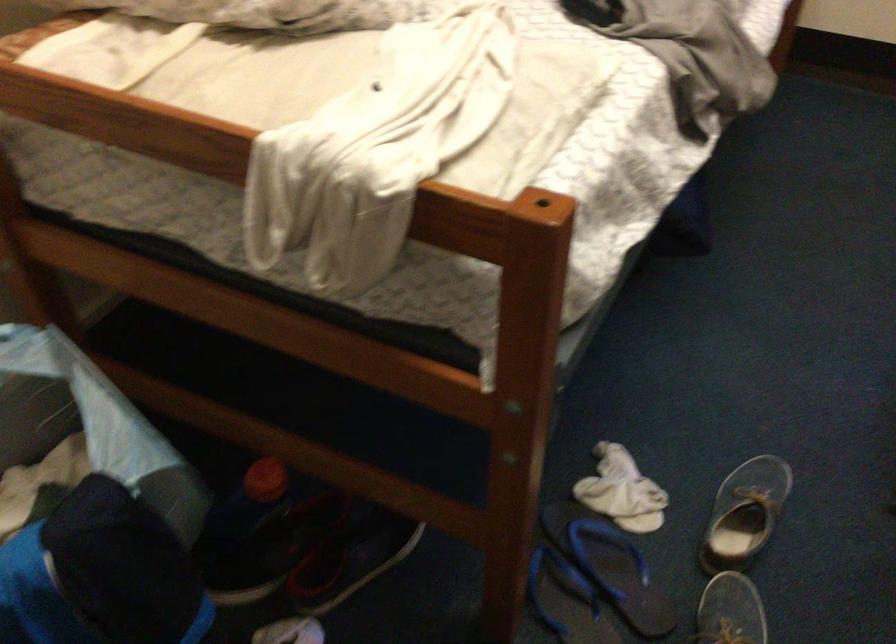
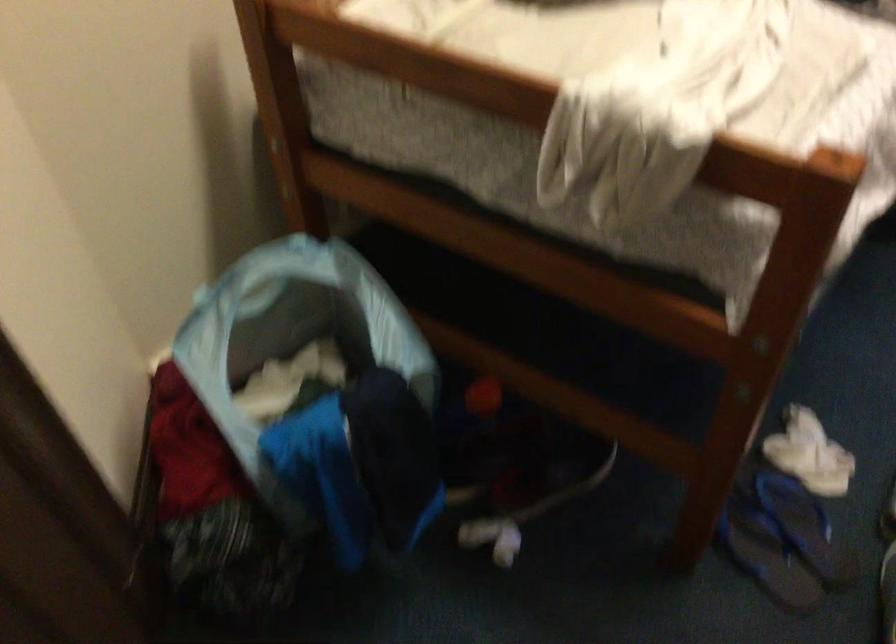
Question: The camera is either moving clockwise (left) or counter-clockwise (right) around the object. The first image is from the beginning of the video and the second image is from the end. Is the camera moving left or right when shooting the video?

Choices:
 (A) Left
 (B) Right

Answer: (B)